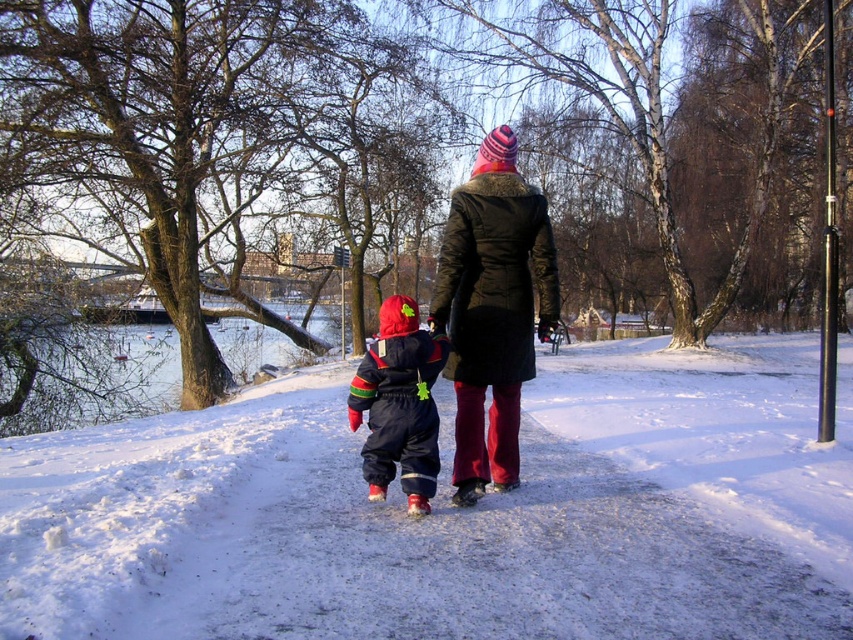
Is white powdery snow at center bigger than velvet red snowsuit at center?

Yes.

At what (x,y) coordinates should I click in order to perform the action: click on white powdery snow at center. Please return your answer as a coordinate pair (x, y). This screenshot has width=853, height=640. Looking at the image, I should click on (450, 513).

Is point (297, 577) farther from camera compared to point (392, 396)?

No, (297, 577) is closer to viewer.

Identify the location of white powdery snow at center. The width and height of the screenshot is (853, 640). (450, 513).

In the scene shown: Can you confirm if white powdery snow at center is positioned to the left of black wool coat at center?

Incorrect, white powdery snow at center is not on the left side of black wool coat at center.

Can you confirm if white powdery snow at center is positioned below black wool coat at center?

Indeed, white powdery snow at center is positioned under black wool coat at center.

Does point (601, 612) lie in front of point (473, 400)?

Yes, point (601, 612) is closer to viewer.

You are a GUI agent. You are given a task and a screenshot of the screen. Output one action in this format:
    pyautogui.click(x=<x>, y=<y>)
    Task: Click on the white powdery snow at center
    This screenshot has height=640, width=853.
    Given the screenshot: What is the action you would take?
    pyautogui.click(x=450, y=513)

Is black wool coat at center to the left of velvet red snowsuit at center from the viewer's perspective?

No, black wool coat at center is not to the left of velvet red snowsuit at center.

How much distance is there between black wool coat at center and velvet red snowsuit at center?

They are 22.95 inches apart.

Locate an element on the screen. black wool coat at center is located at coordinates (492, 308).

Locate an element on the screen. The image size is (853, 640). black wool coat at center is located at coordinates (492, 308).